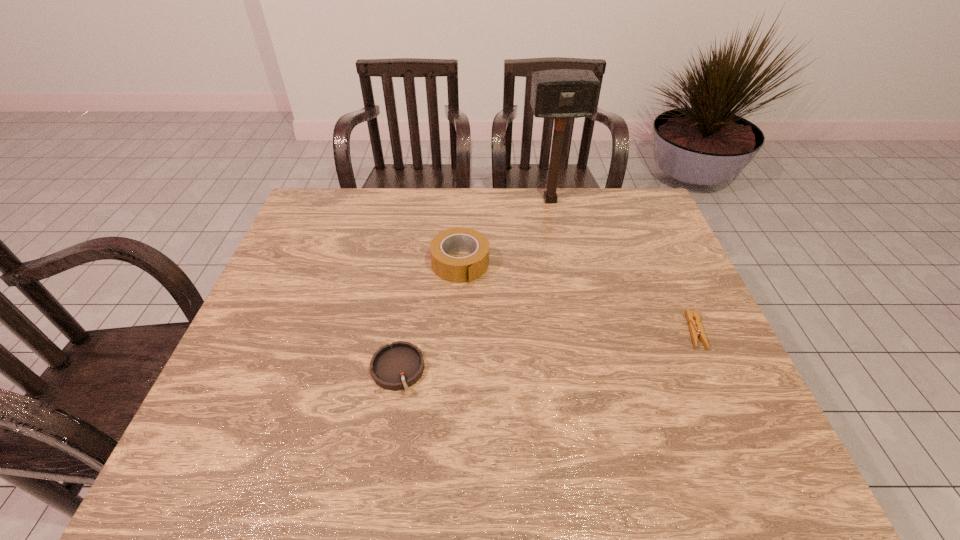
Locate an element on the screen. The width and height of the screenshot is (960, 540). vacant space on the desktop that is between the ashtray and the shortest object and is positioned at the edge of the third shortest object is located at coordinates (509, 355).

Locate an element on the screen. The width and height of the screenshot is (960, 540). vacant space on the desktop that is between the second shortest object and the rightmost object and is positioned on the head of the farthest object is located at coordinates (595, 344).